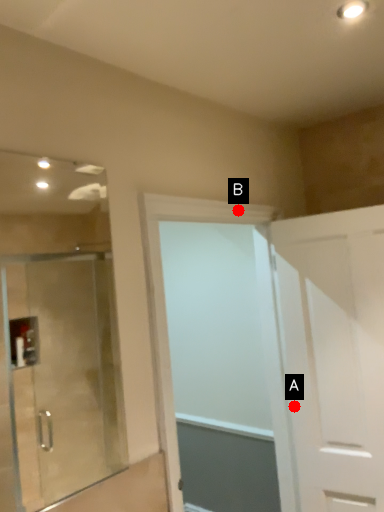
Question: Two points are circled on the image, labeled by A and B beside each circle. Which of the following is the farthest from the observer?

Choices:
 (A) A is further
 (B) B is further

Answer: (A)